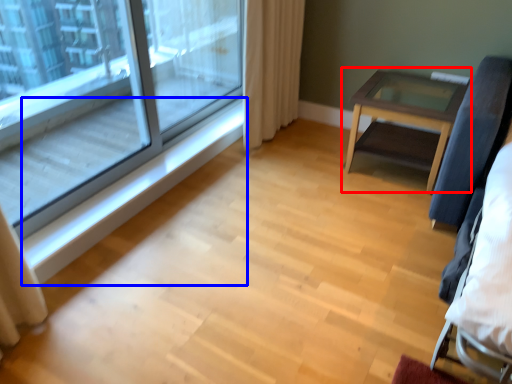
Question: Which object appears closest to the camera in this image, table (highlighted by a red box) or window sill (highlighted by a blue box)?

Choices:
 (A) table
 (B) window sill

Answer: (B)